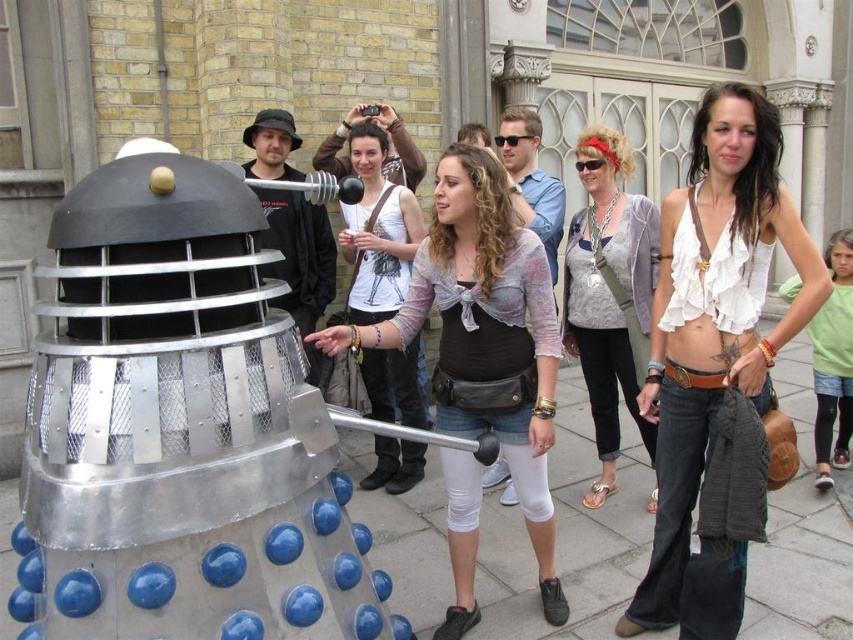
You are a fashion designer observing the two tops at the event. Which top has a wider silhouette between the matte black shirt at center and the white cotton tank top at center?

The matte black shirt at center has a wider silhouette than the white cotton tank top at center, as its width surpasses the latter.

You are a fashion designer observing two people in the scene. One is wearing a matte black shirt at center and the other a white cotton tank top at center. Which person is standing to the right of the other?

The matte black shirt at center is positioned on the right side of white cotton tank top at center, so the person wearing the matte black shirt at center is standing to the right of the person in the white cotton tank top at center.

You are a photographer trying to capture the Dalek from the best angle. You notice two points marked in the scene at coordinates point [512,404] and point [373,285]. Which point is closer to your camera position?

Point [512,404] is closer to the camera than point [373,285].